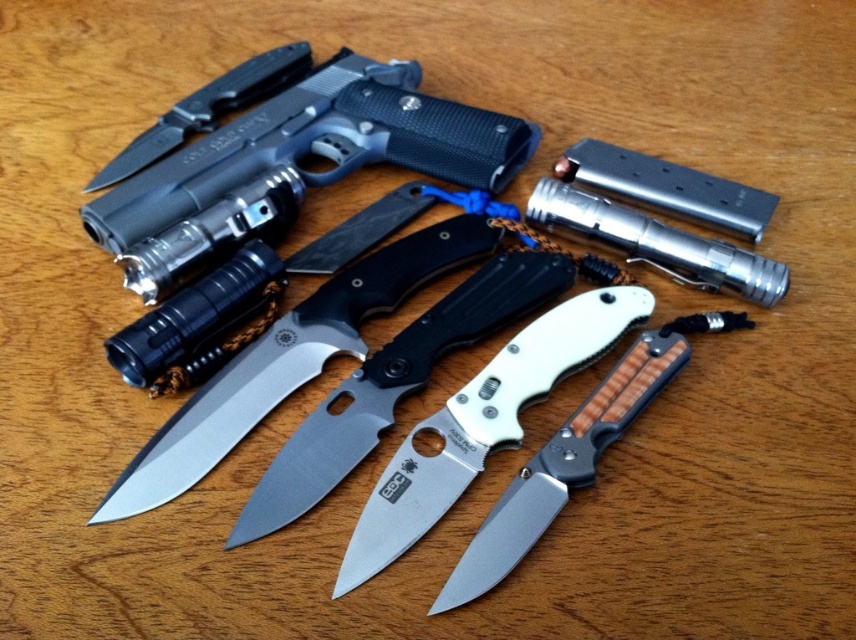
You are a security officer inspecting the tactical gear setup. You need to quickly identify the position of the silver metallic knife at center and the silver metallic folding knife at center. Which one is positioned to the left?

The silver metallic knife at center is positioned to the left of the silver metallic folding knife at center.

From the picture: You are a collector of tactical gear and want to display these knives in a case. Given the silver metallic knife at center and the matte black knife at center, which one should you place on the lower shelf to ensure proper visibility of both?

The matte black knife at center should be placed on the lower shelf since it is shorter than the silver metallic knife at center, allowing both to be visible without obstruction.